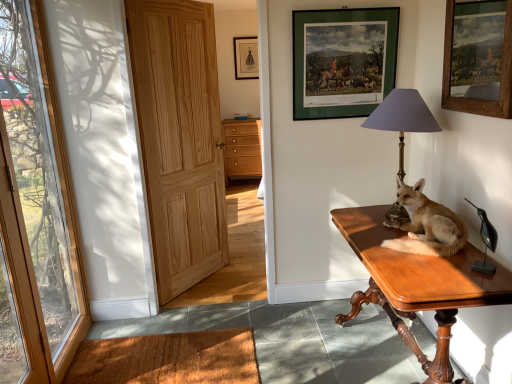
Identify the location of vacant area situated to the left side of black glossy bird at right. The height and width of the screenshot is (384, 512). (443, 272).